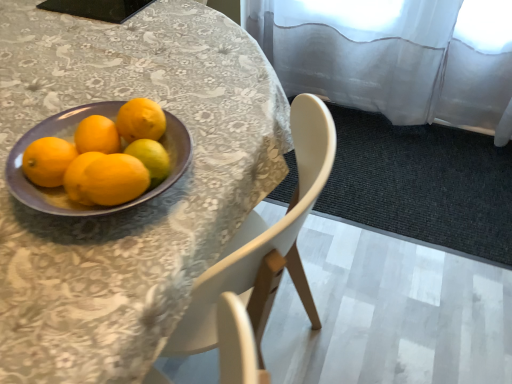
In order to click on free point above purple glossy bowl at left (from a real-world perspective) in this screenshot , I will do `click(110, 147)`.